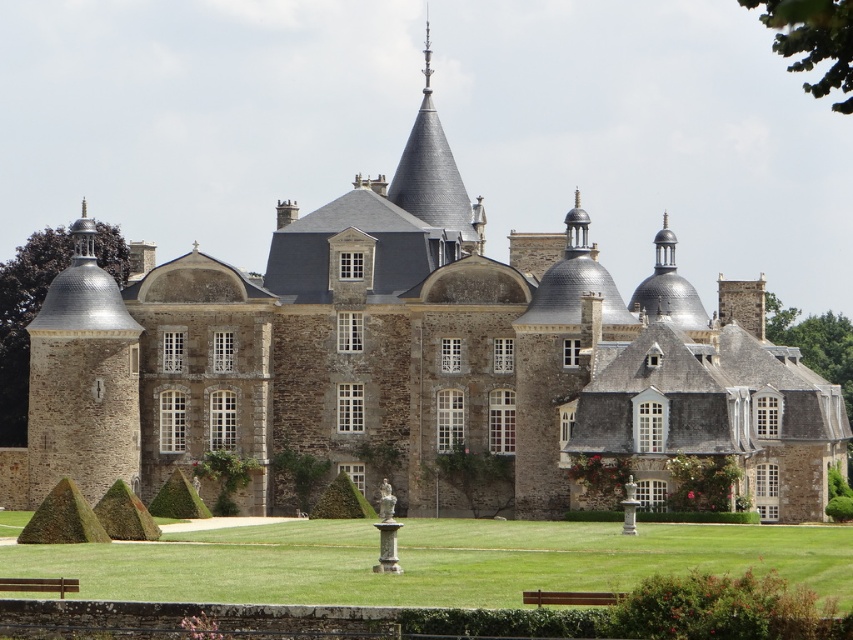
Question: Which point appears closest to the camera in this image?

Choices:
 (A) (845, 552)
 (B) (618, 596)

Answer: (B)

Question: Which point is farther to the camera?

Choices:
 (A) (322, 515)
 (B) (549, 589)
 (C) (184, 588)

Answer: (A)

Question: Does green grass at center have a lesser width compared to brown wooden bench at lower center?

Choices:
 (A) yes
 (B) no

Answer: (B)

Question: Observing the image, what is the correct spatial positioning of green grass at center in reference to brown wooden bench at lower center?

Choices:
 (A) left
 (B) right

Answer: (A)

Question: Is green grass at center thinner than green leafy hedge at center?

Choices:
 (A) no
 (B) yes

Answer: (A)

Question: Among these points, which one is nearest to the camera?

Choices:
 (A) (349, 504)
 (B) (540, 589)
 (C) (28, 588)
 (D) (776, 570)

Answer: (C)